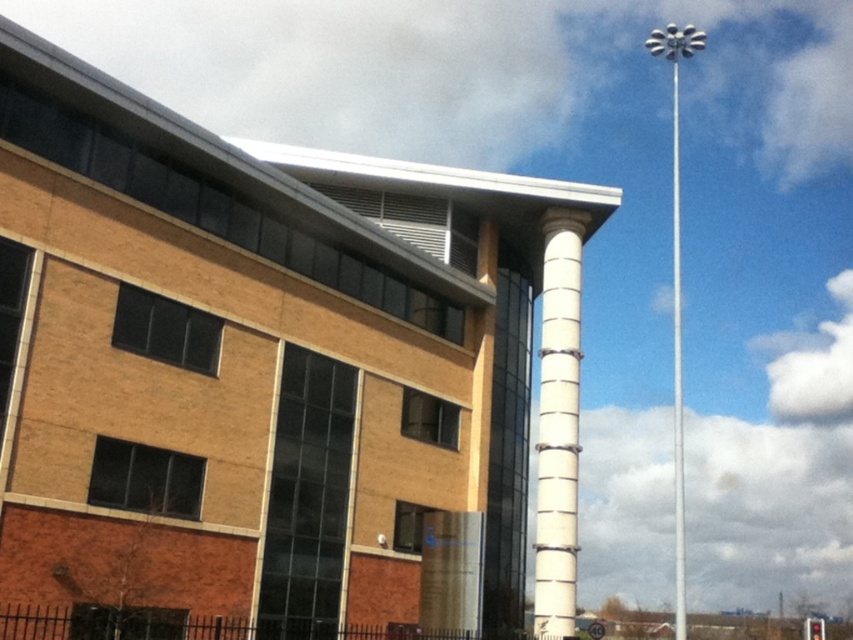
Question: Which object appears farthest from the camera in this image?

Choices:
 (A) white glossy column at center
 (B) white metallic pole at right

Answer: (A)

Question: Which point is farther to the camera?

Choices:
 (A) white glossy column at center
 (B) white metallic pole at right

Answer: (A)

Question: Among these points, which one is nearest to the camera?

Choices:
 (A) (675, 77)
 (B) (550, 269)

Answer: (B)

Question: Does white glossy column at center appear on the left side of white metallic pole at right?

Choices:
 (A) yes
 (B) no

Answer: (A)

Question: Does white glossy column at center have a lesser width compared to white metallic pole at right?

Choices:
 (A) yes
 (B) no

Answer: (A)

Question: Does white glossy column at center have a lesser width compared to white metallic pole at right?

Choices:
 (A) yes
 (B) no

Answer: (A)